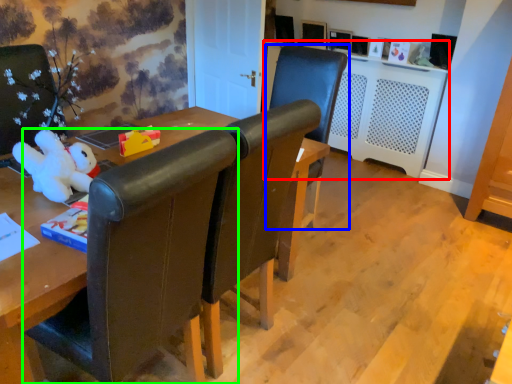
Question: Which object is the closest to the computer desk (highlighted by a red box)? Choose among these: chair (highlighted by a blue box) or chair (highlighted by a green box).

Choices:
 (A) chair
 (B) chair

Answer: (A)